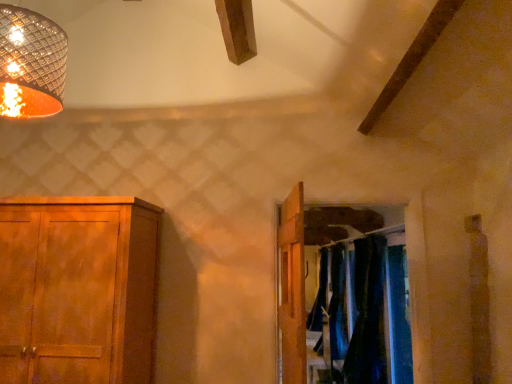
Where is `dark blue fabric at center`? This screenshot has height=384, width=512. dark blue fabric at center is located at coordinates (360, 315).

This screenshot has height=384, width=512. Describe the element at coordinates (360, 315) in the screenshot. I see `dark blue fabric at center` at that location.

Image resolution: width=512 pixels, height=384 pixels. I want to click on wooden door at center, so click(x=292, y=289).

This screenshot has width=512, height=384. What do you see at coordinates (77, 290) in the screenshot?
I see `wooden cabinet at left` at bounding box center [77, 290].

Measure the distance between wooden cabinet at left and camera.

wooden cabinet at left and camera are 6.77 feet apart from each other.

Locate an element on the screen. This screenshot has width=512, height=384. metallic woven shade at upper left is located at coordinates (31, 64).

Based on the photo, considering the sizes of metallic woven shade at upper left and wooden door at center in the image, is metallic woven shade at upper left wider or thinner than wooden door at center?

Clearly, metallic woven shade at upper left has more width compared to wooden door at center.

From a real-world perspective, is metallic woven shade at upper left physically below wooden door at center?

No, from a real-world perspective, metallic woven shade at upper left is not below wooden door at center.

Is metallic woven shade at upper left positioned far away from wooden door at center?

Absolutely, metallic woven shade at upper left is distant from wooden door at center.

Where is `lamp on the left side of wooden door at center`? The width and height of the screenshot is (512, 384). lamp on the left side of wooden door at center is located at coordinates (31, 64).

Between dark blue fabric at center and blue velvet curtains at center, which appears as the 2th curtain when viewed from the front, which one has larger width?

Wider between the two is blue velvet curtains at center, which appears as the 2th curtain when viewed from the front.

Considering the relative sizes of dark blue fabric at center and blue velvet curtains at center, which appears as the 2th curtain when viewed from the front, in the image provided, is dark blue fabric at center taller than blue velvet curtains at center, which appears as the 2th curtain when viewed from the front,?

Incorrect, the height of dark blue fabric at center is not larger of that of blue velvet curtains at center, which appears as the 2th curtain when viewed from the front.

Could you tell me if dark blue fabric at center is turned towards blue velvet curtains at center, arranged as the 1th curtain when viewed from the back?

No, dark blue fabric at center is not facing towards blue velvet curtains at center, arranged as the 1th curtain when viewed from the back.

Identify the location of curtain located in front of the blue velvet curtains at center, arranged as the 1th curtain when viewed from the back. (368, 315).

How distant is blue velvet curtains at center, which appears as the 2th curtain when viewed from the front, from velvet dark blue curtains at right, which is the 1th curtain in front-to-back order?

blue velvet curtains at center, which appears as the 2th curtain when viewed from the front, is 9.73 inches from velvet dark blue curtains at right, which is the 1th curtain in front-to-back order.

Is point (342, 302) farther from viewer compared to point (380, 383)?

Yes, point (342, 302) is behind point (380, 383).

Does blue velvet curtains at center, arranged as the 1th curtain when viewed from the back, have a lesser width compared to velvet dark blue curtains at right, which is the 1th curtain in front-to-back order?

Yes, blue velvet curtains at center, arranged as the 1th curtain when viewed from the back, is thinner than velvet dark blue curtains at right, which is the 1th curtain in front-to-back order.

Can you see metallic woven shade at upper left touching blue velvet curtains at center, which appears as the 2th curtain when viewed from the front?

No, metallic woven shade at upper left is not in contact with blue velvet curtains at center, which appears as the 2th curtain when viewed from the front.

Which is behind, metallic woven shade at upper left or blue velvet curtains at center, which appears as the 2th curtain when viewed from the front?

blue velvet curtains at center, which appears as the 2th curtain when viewed from the front, is behind.

Is metallic woven shade at upper left positioned beyond the bounds of blue velvet curtains at center, arranged as the 1th curtain when viewed from the back?

Yes, metallic woven shade at upper left is located beyond the bounds of blue velvet curtains at center, arranged as the 1th curtain when viewed from the back.

From the image's perspective, is metallic woven shade at upper left on blue velvet curtains at center, which appears as the 2th curtain when viewed from the front?

Yes, from the image's perspective, metallic woven shade at upper left is above blue velvet curtains at center, which appears as the 2th curtain when viewed from the front.

In terms of size, does wooden cabinet at left appear bigger or smaller than wooden door at center?

Considering their sizes, wooden cabinet at left takes up more space than wooden door at center.

From the picture: Is wooden cabinet at left wider than wooden door at center?

Correct, the width of wooden cabinet at left exceeds that of wooden door at center.

Is point (55, 357) closer or farther from the camera than point (285, 352)?

Point (55, 357) is farther from the camera than point (285, 352).

Considering the positions of objects wooden door at center and velvet dark blue curtains at right, marked as the second curtain in a back-to-front arrangement, in the image provided, who is more to the left, wooden door at center or velvet dark blue curtains at right, marked as the second curtain in a back-to-front arrangement,?

From the viewer's perspective, wooden door at center appears more on the left side.

Is wooden door at center smaller than velvet dark blue curtains at right, marked as the second curtain in a back-to-front arrangement?

Yes.

Considering the relative sizes of wooden door at center and velvet dark blue curtains at right, which is the 1th curtain in front-to-back order, in the image provided, is wooden door at center taller than velvet dark blue curtains at right, which is the 1th curtain in front-to-back order,?

In fact, wooden door at center may be shorter than velvet dark blue curtains at right, which is the 1th curtain in front-to-back order.

Is wooden door at center far away from velvet dark blue curtains at right, marked as the second curtain in a back-to-front arrangement?

wooden door at center is far away from velvet dark blue curtains at right, marked as the second curtain in a back-to-front arrangement.

From a real-world perspective, is blue velvet curtains at center, which appears as the 2th curtain when viewed from the front, physically located above or below dark blue fabric at center?

blue velvet curtains at center, which appears as the 2th curtain when viewed from the front, is situated lower than dark blue fabric at center in the real world.

From the image's perspective, which object appears higher, blue velvet curtains at center, arranged as the 1th curtain when viewed from the back, or dark blue fabric at center?

From the image's view, dark blue fabric at center is above.

Is blue velvet curtains at center, which appears as the 2th curtain when viewed from the front, in front of or behind dark blue fabric at center in the image?

blue velvet curtains at center, which appears as the 2th curtain when viewed from the front, is behind dark blue fabric at center.

The width and height of the screenshot is (512, 384). Find the location of `door that is behind the metallic woven shade at upper left`. door that is behind the metallic woven shade at upper left is located at coordinates (292, 289).

At what (x,y) coordinates should I click in order to perform the action: click on laundry in front of the blue velvet curtains at center, which appears as the 2th curtain when viewed from the front. Please return your answer as a coordinate pair (x, y). Image resolution: width=512 pixels, height=384 pixels. Looking at the image, I should click on (360, 315).

Estimate the real-world distances between objects in this image. Which object is closer to velvet dark blue curtains at right, which is the 1th curtain in front-to-back order, wooden cabinet at left or metallic woven shade at upper left?

wooden cabinet at left is closer to velvet dark blue curtains at right, which is the 1th curtain in front-to-back order.

Looking at the image, which one is located further to wooden cabinet at left, dark blue fabric at center or wooden door at center?

dark blue fabric at center lies further to wooden cabinet at left than the other object.

Which object lies further to the anchor point wooden cabinet at left, velvet dark blue curtains at right, which is the 1th curtain in front-to-back order, or dark blue fabric at center?

The object further to wooden cabinet at left is velvet dark blue curtains at right, which is the 1th curtain in front-to-back order.

Looking at the image, which one is located further to velvet dark blue curtains at right, marked as the second curtain in a back-to-front arrangement, wooden cabinet at left or wooden door at center?

Based on the image, wooden cabinet at left appears to be further to velvet dark blue curtains at right, marked as the second curtain in a back-to-front arrangement.

Which object lies nearer to the anchor point metallic woven shade at upper left, blue velvet curtains at center, which appears as the 2th curtain when viewed from the front, or dark blue fabric at center?

The object closer to metallic woven shade at upper left is dark blue fabric at center.

Considering their positions, is wooden cabinet at left positioned further to wooden door at center than metallic woven shade at upper left?

metallic woven shade at upper left lies further to wooden door at center than the other object.

Which object lies nearer to the anchor point wooden door at center, velvet dark blue curtains at right, which is the 1th curtain in front-to-back order, or metallic woven shade at upper left?

The object closer to wooden door at center is metallic woven shade at upper left.

Looking at the image, which one is located further to velvet dark blue curtains at right, marked as the second curtain in a back-to-front arrangement, wooden door at center or wooden cabinet at left?

Among the two, wooden cabinet at left is located further to velvet dark blue curtains at right, marked as the second curtain in a back-to-front arrangement.

Where is `door between wooden cabinet at left and dark blue fabric at center in the horizontal direction`? The image size is (512, 384). door between wooden cabinet at left and dark blue fabric at center in the horizontal direction is located at coordinates (292, 289).

This screenshot has width=512, height=384. I want to click on cupboard between metallic woven shade at upper left and blue velvet curtains at center, which appears as the 2th curtain when viewed from the front, in the front-back direction, so click(77, 290).

Locate an element on the screen. cupboard between metallic woven shade at upper left and velvet dark blue curtains at right, marked as the second curtain in a back-to-front arrangement, along the z-axis is located at coordinates (77, 290).

Identify the location of curtain between wooden door at center and blue velvet curtains at center, arranged as the 1th curtain when viewed from the back, along the z-axis. (368, 315).